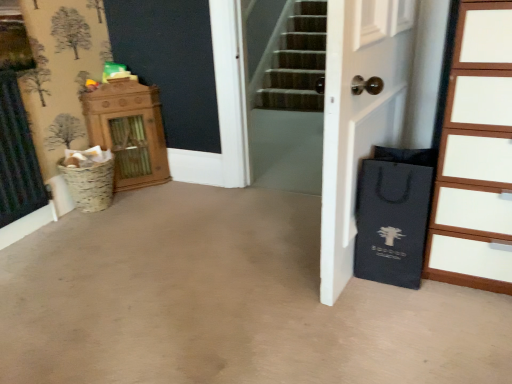
Question: Is the surface of black paper bag at right in direct contact with wooden chest of drawers at right?

Choices:
 (A) yes
 (B) no

Answer: (B)

Question: Is black paper bag at right facing away from wooden chest of drawers at right?

Choices:
 (A) yes
 (B) no

Answer: (B)

Question: Is black paper bag at right facing towards wooden chest of drawers at right?

Choices:
 (A) no
 (B) yes

Answer: (A)

Question: Is the depth of black paper bag at right less than that of wooden chest of drawers at right?

Choices:
 (A) no
 (B) yes

Answer: (A)

Question: From a real-world perspective, is black paper bag at right under wooden chest of drawers at right?

Choices:
 (A) no
 (B) yes

Answer: (B)

Question: Considering the relative sizes of black paper bag at right and wooden chest of drawers at right in the image provided, is black paper bag at right smaller than wooden chest of drawers at right?

Choices:
 (A) no
 (B) yes

Answer: (B)

Question: From the image's perspective, does wooden chest of drawers at right appear lower than white matte door at center?

Choices:
 (A) yes
 (B) no

Answer: (A)

Question: Is wooden chest of drawers at right oriented towards white matte door at center?

Choices:
 (A) yes
 (B) no

Answer: (B)

Question: Is wooden chest of drawers at right not within white matte door at center?

Choices:
 (A) yes
 (B) no

Answer: (A)

Question: Is wooden chest of drawers at right at the right side of white matte door at center?

Choices:
 (A) no
 (B) yes

Answer: (B)

Question: Can you confirm if wooden chest of drawers at right is thinner than white matte door at center?

Choices:
 (A) no
 (B) yes

Answer: (A)

Question: Is wooden chest of drawers at right far away from white matte door at center?

Choices:
 (A) no
 (B) yes

Answer: (A)

Question: From the image's perspective, is wooden chest of drawers at right below black paper bag at right?

Choices:
 (A) yes
 (B) no

Answer: (B)